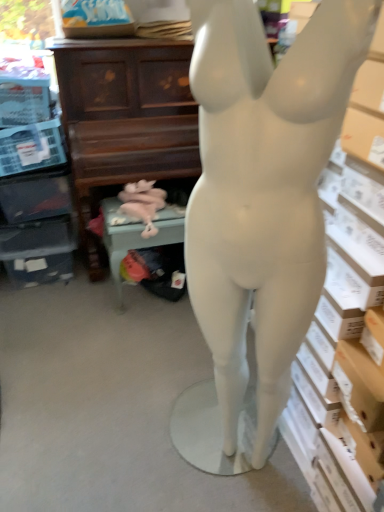
In order to click on free space above green fabric chair at lower center (from a real-world perspective) in this screenshot , I will do `click(142, 216)`.